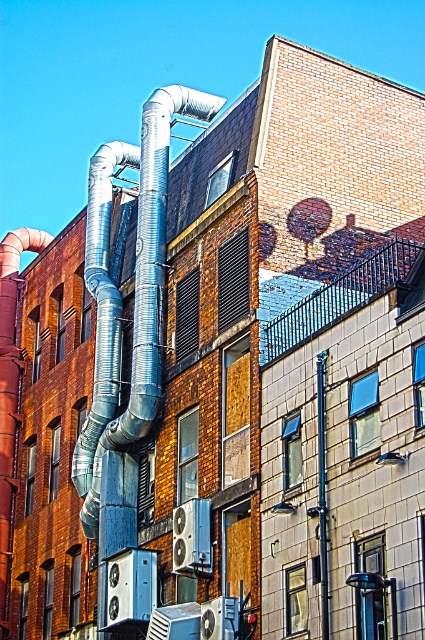
Question: Which object appears closest to the camera in this image?

Choices:
 (A) silver metallic pipes at left
 (B) brushed metal pole at center

Answer: (B)

Question: Observing the image, what is the correct spatial positioning of silver metallic pipes at left in reference to brushed metal pole at center?

Choices:
 (A) right
 (B) left

Answer: (B)

Question: Does silver metallic pipes at left appear over brushed metal pole at center?

Choices:
 (A) yes
 (B) no

Answer: (A)

Question: Among these points, which one is farthest from the camera?

Choices:
 (A) (90, 531)
 (B) (326, 353)

Answer: (A)

Question: Which point is farther to the camera?

Choices:
 (A) silver metallic pipes at left
 (B) brushed metal pole at center

Answer: (A)

Question: Observing the image, what is the correct spatial positioning of silver metallic pipes at left in reference to brushed metal pole at center?

Choices:
 (A) above
 (B) below

Answer: (A)